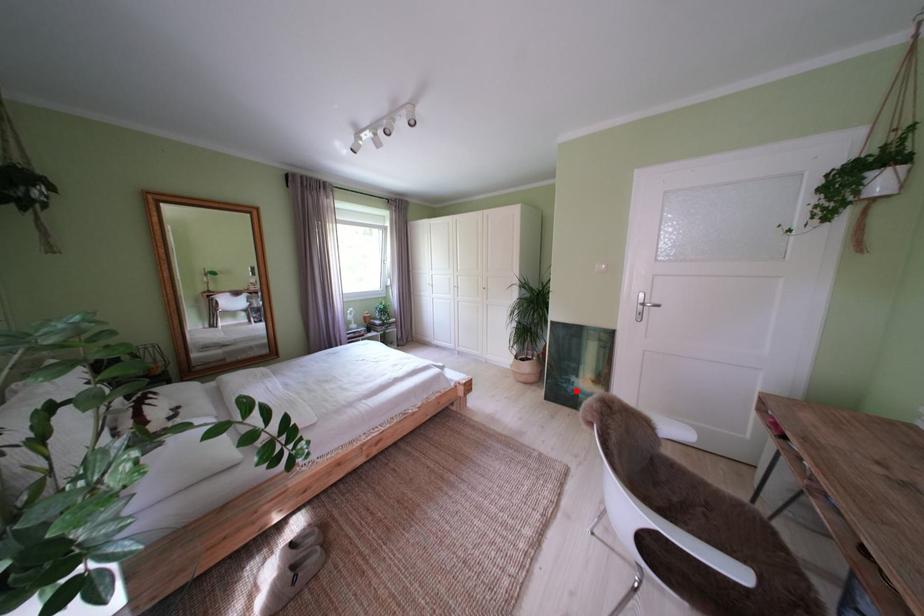
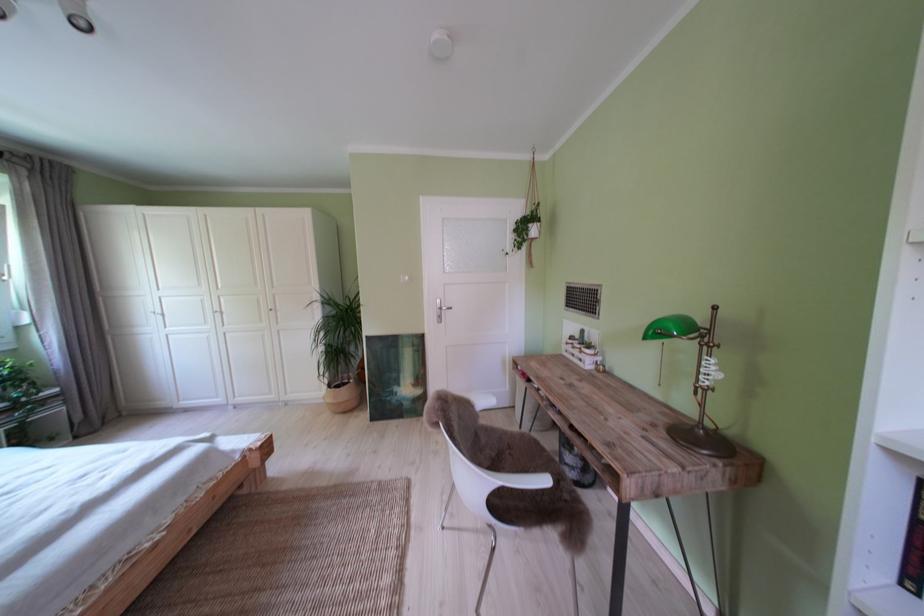
Where in the second image is the point corresponding to the highlighted location from the first image?

(399, 403)